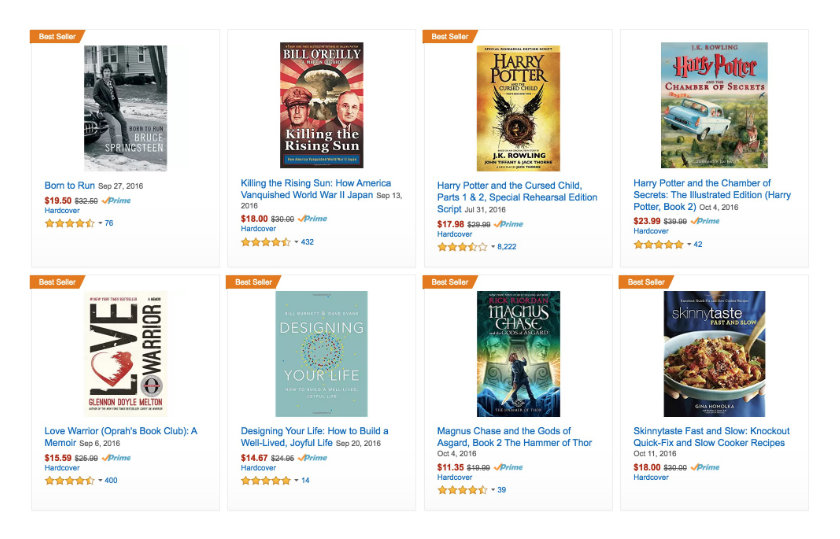
This screenshot has width=840, height=539. In order to click on books in this screenshot , I will do `click(139, 135)`, `click(276, 137)`, `click(475, 145)`, `click(691, 153)`, `click(127, 366)`, `click(300, 368)`, `click(504, 377)`, `click(691, 384)`.